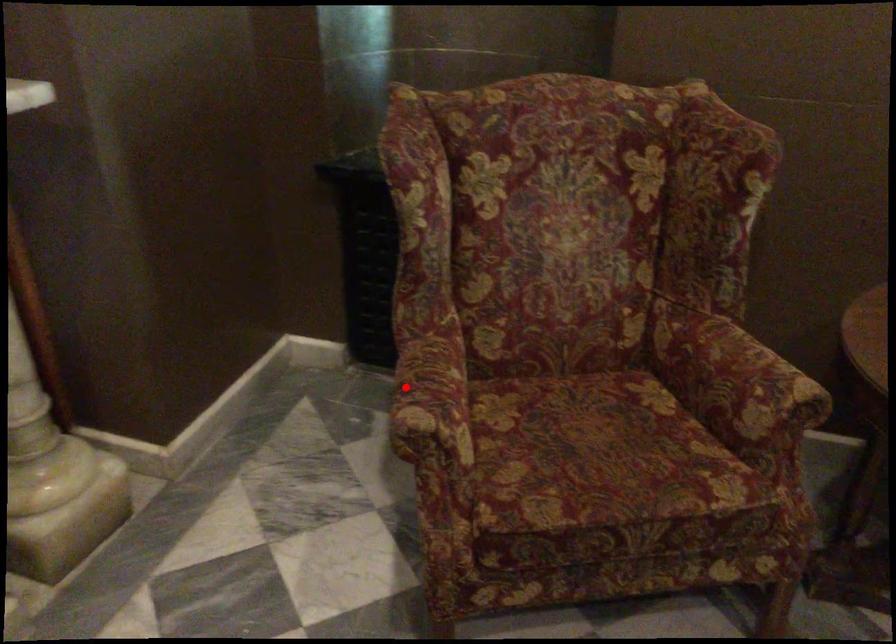
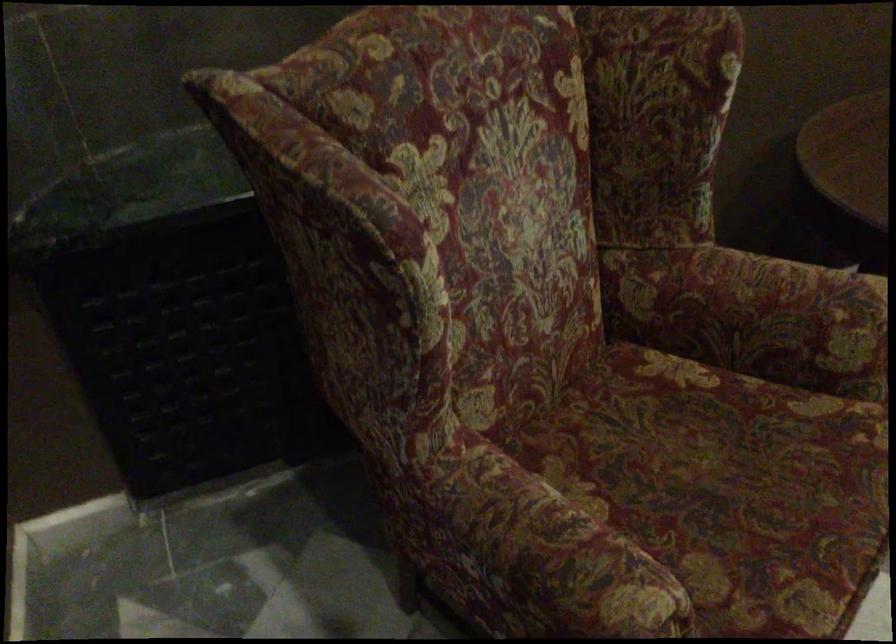
Question: I am providing you with two images of the same scene from different viewpoints. Given a red point in image1, look at the same physical point in image2. Is it:

Choices:
 (A) Closer to the viewpoint
 (B) Farther from the viewpoint

Answer: (A)